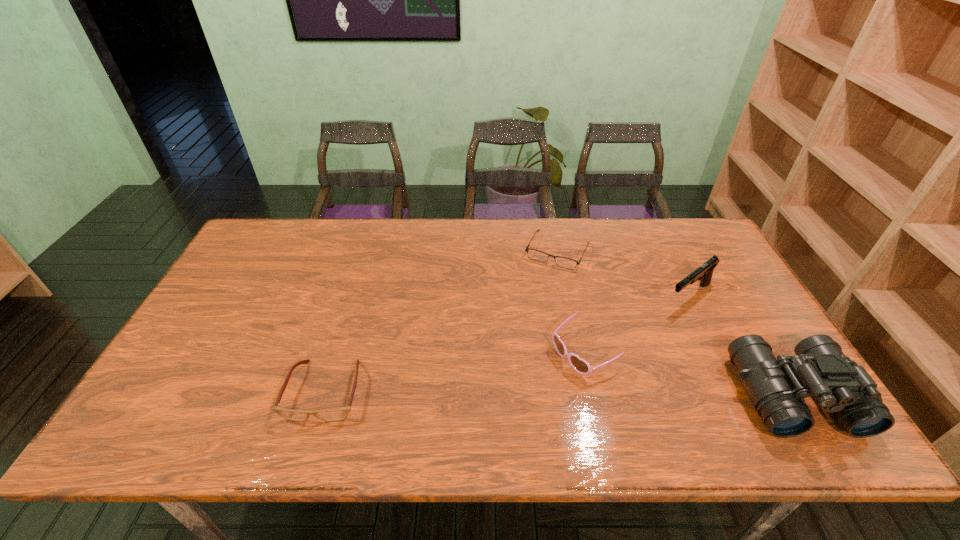
Select which object is the second closest to the second farthest object. Please provide its 2D coordinates. Your answer should be formatted as a tuple, i.e. [(x, y)], where the tuple contains the x and y coordinates of a point satisfying the conditions above.

[(564, 262)]

The image size is (960, 540). I want to click on vacant space that satisfies the following two spatial constraints: 1. on the front side of the sunglasses; 2. on the left side of the shortest object, so click(579, 353).

At what (x,y) coordinates should I click in order to perform the action: click on free space that satisfies the following two spatial constraints: 1. on the back side of the second farthest object; 2. on the left side of the sunglasses. Please return your answer as a coordinate pair (x, y). The height and width of the screenshot is (540, 960). Looking at the image, I should click on (571, 296).